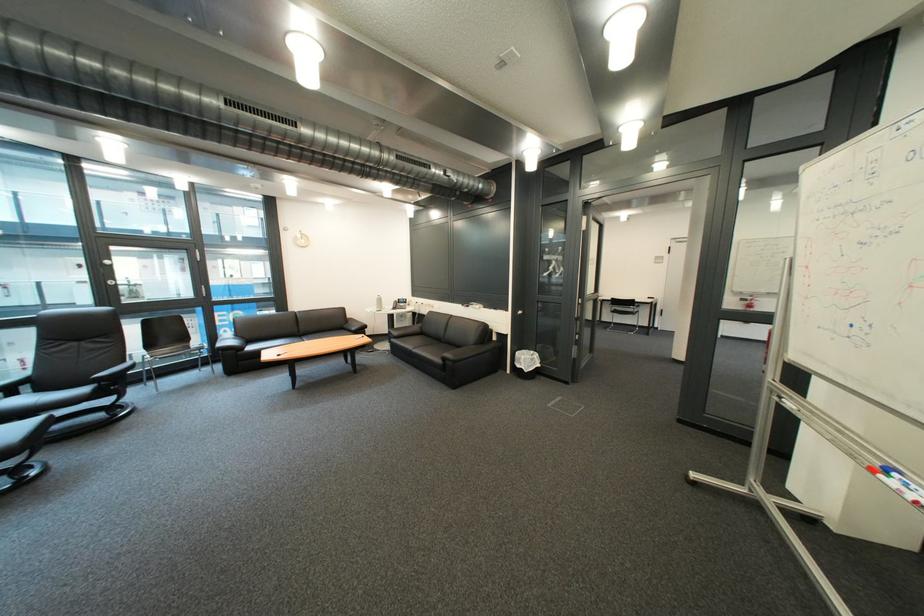
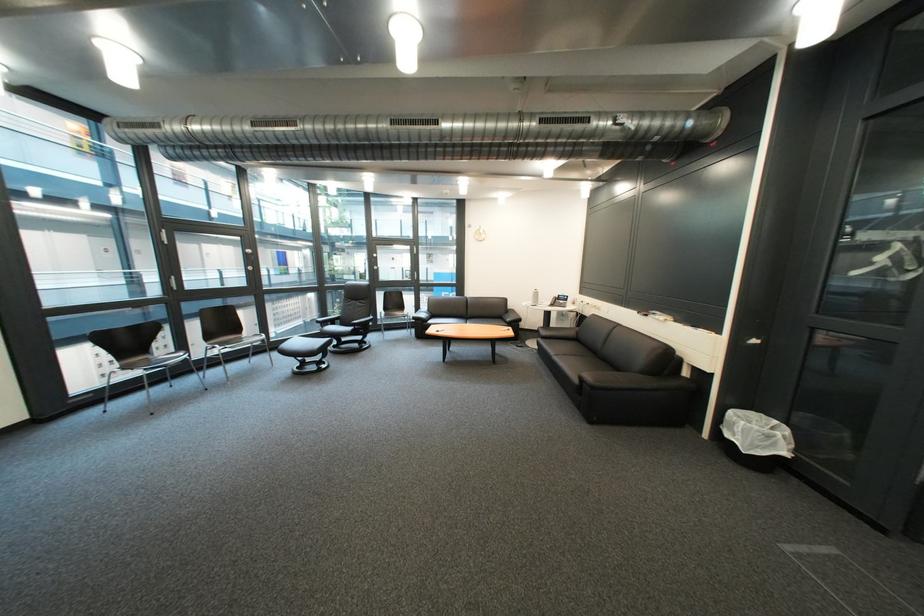
Locate, in the second image, the point that corresponds to the point at 264,350 in the first image.

(444, 323)